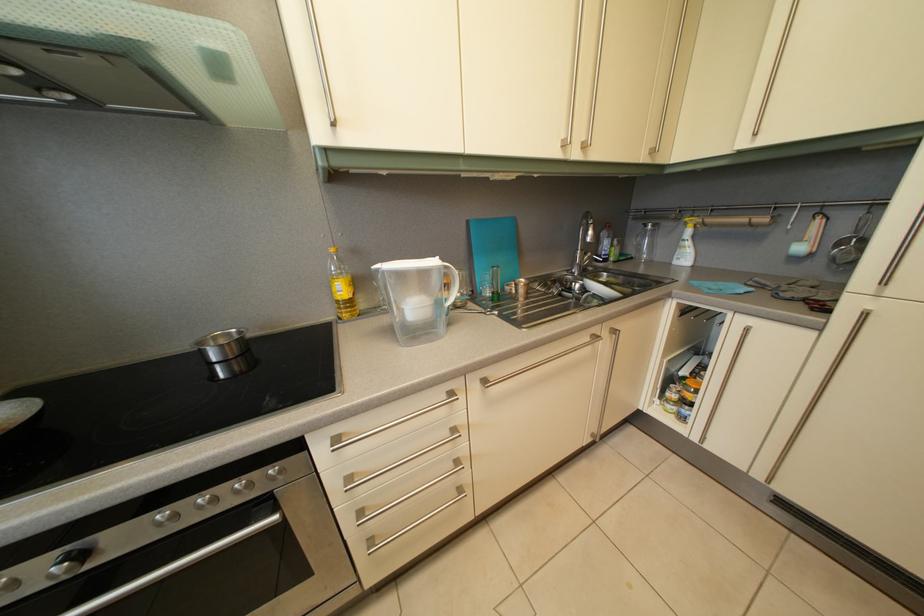
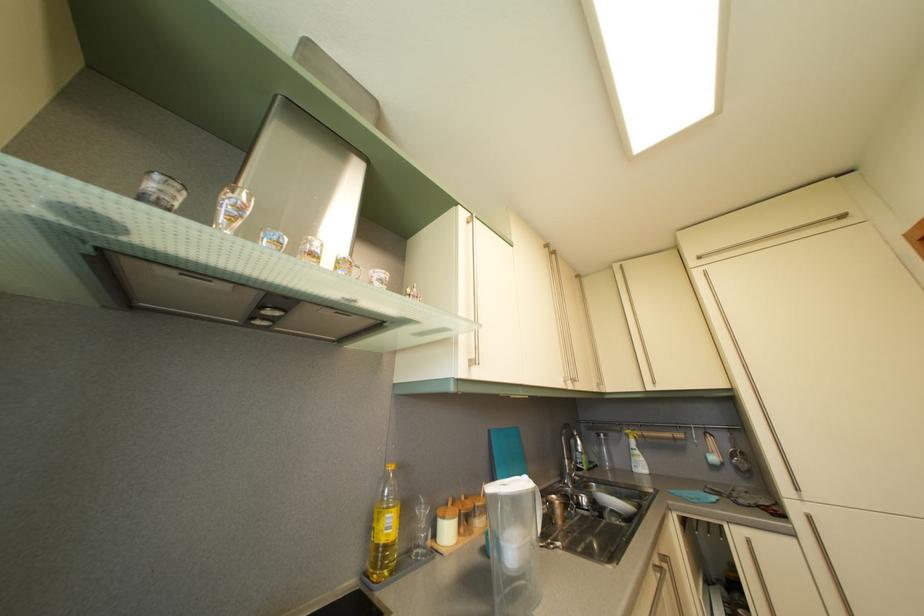
In the second image, find the point that corresponds to (x=421, y=315) in the first image.

(521, 554)